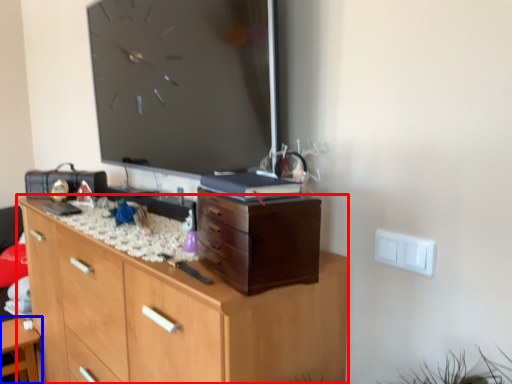
Question: Which object appears farthest to the camera in this image, chest of drawers (highlighted by a red box) or table (highlighted by a blue box)?

Choices:
 (A) chest of drawers
 (B) table

Answer: (B)